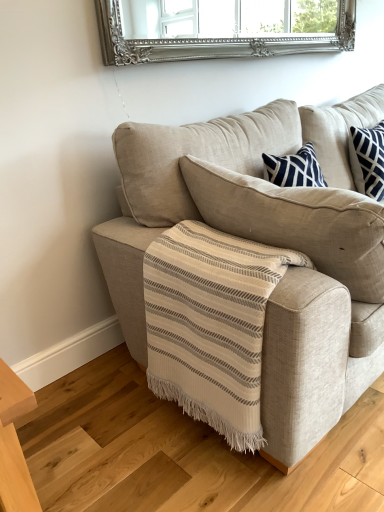
This screenshot has height=512, width=384. What are the coordinates of `wooden floor at lower left` in the screenshot? It's located at (182, 452).

The image size is (384, 512). What do you see at coordinates (182, 452) in the screenshot? I see `wooden floor at lower left` at bounding box center [182, 452].

Measure the distance between point (130, 389) and camera.

A distance of 5.49 feet exists between point (130, 389) and camera.

What do you see at coordinates (267, 243) in the screenshot? Image resolution: width=384 pixels, height=512 pixels. I see `beige fabric couch at center` at bounding box center [267, 243].

Measure the distance between point (x=308, y=116) and camera.

The distance of point (x=308, y=116) from camera is 2.06 meters.

Where is `beige fabric couch at center`? The image size is (384, 512). beige fabric couch at center is located at coordinates (267, 243).

This screenshot has height=512, width=384. In order to click on wooden floor at lower left in this screenshot , I will do `click(182, 452)`.

Between wooden floor at lower left and beige fabric couch at center, which one appears on the left side from the viewer's perspective?

Positioned to the left is wooden floor at lower left.

Does wooden floor at lower left lie behind beige fabric couch at center?

No.

Is point (116, 489) farther from viewer compared to point (277, 395)?

Yes, point (116, 489) is farther from viewer.

From the image's perspective, is wooden floor at lower left positioned above or below beige fabric couch at center?

wooden floor at lower left is situated lower than beige fabric couch at center in the image.

From a real-world perspective, is wooden floor at lower left on top of beige fabric couch at center?

No, from a real-world perspective, wooden floor at lower left is not on top of beige fabric couch at center.

Between wooden floor at lower left and beige fabric couch at center, which one has smaller width?

beige fabric couch at center.

Consider the image. Considering the relative sizes of wooden floor at lower left and beige fabric couch at center in the image provided, is wooden floor at lower left shorter than beige fabric couch at center?

Yes.

Is wooden floor at lower left bigger than beige fabric couch at center?

No.

Would you say wooden floor at lower left contains beige fabric couch at center?

Actually, beige fabric couch at center is outside wooden floor at lower left.

From the picture: Would you say wooden floor at lower left is a long distance from beige fabric couch at center?

wooden floor at lower left is near beige fabric couch at center, not far away.

Is beige fabric couch at center at the back of wooden floor at lower left?

Yes.

How many degrees apart are the facing directions of wooden floor at lower left and beige fabric couch at center?

179 degrees separate the facing orientations of wooden floor at lower left and beige fabric couch at center.

At what (x,y) coordinates should I click in order to perform the action: click on stair lying below the beige fabric couch at center (from the image's perspective). Please return your answer as a coordinate pair (x, y). The width and height of the screenshot is (384, 512). Looking at the image, I should click on (182, 452).

Is beige fabric couch at center to the left of wooden floor at lower left from the viewer's perspective?

In fact, beige fabric couch at center is to the right of wooden floor at lower left.

Which object is further away from the camera taking this photo, beige fabric couch at center or wooden floor at lower left?

beige fabric couch at center is further from the camera.

Is point (269, 192) less distant than point (350, 412)?

Yes, it is in front of point (350, 412).

From the image's perspective, relative to wooden floor at lower left, is beige fabric couch at center above or below?

Clearly, from the image's perspective, beige fabric couch at center is above wooden floor at lower left.

From a real-world perspective, is beige fabric couch at center over wooden floor at lower left?

Yes, from a real-world perspective, beige fabric couch at center is above wooden floor at lower left.

Which of these two, beige fabric couch at center or wooden floor at lower left, is wider?

wooden floor at lower left.

Considering the sizes of beige fabric couch at center and wooden floor at lower left in the image, is beige fabric couch at center taller or shorter than wooden floor at lower left?

Considering their sizes, beige fabric couch at center has more height than wooden floor at lower left.

Considering the sizes of objects beige fabric couch at center and wooden floor at lower left in the image provided, who is bigger, beige fabric couch at center or wooden floor at lower left?

With larger size is beige fabric couch at center.

Is beige fabric couch at center located outside wooden floor at lower left?

Indeed, beige fabric couch at center is completely outside wooden floor at lower left.

Is beige fabric couch at center beside wooden floor at lower left?

No, beige fabric couch at center is not with wooden floor at lower left.

Is beige fabric couch at center turned away from wooden floor at lower left?

beige fabric couch at center is not turned away from wooden floor at lower left.

Locate an element on the screen. Image resolution: width=384 pixels, height=512 pixels. studio couch located above the wooden floor at lower left (from the image's perspective) is located at coordinates (267, 243).

This screenshot has width=384, height=512. Identify the location of studio couch behind the wooden floor at lower left. (267, 243).

Locate an element on the screen. Image resolution: width=384 pixels, height=512 pixels. stair below the beige fabric couch at center (from the image's perspective) is located at coordinates (182, 452).